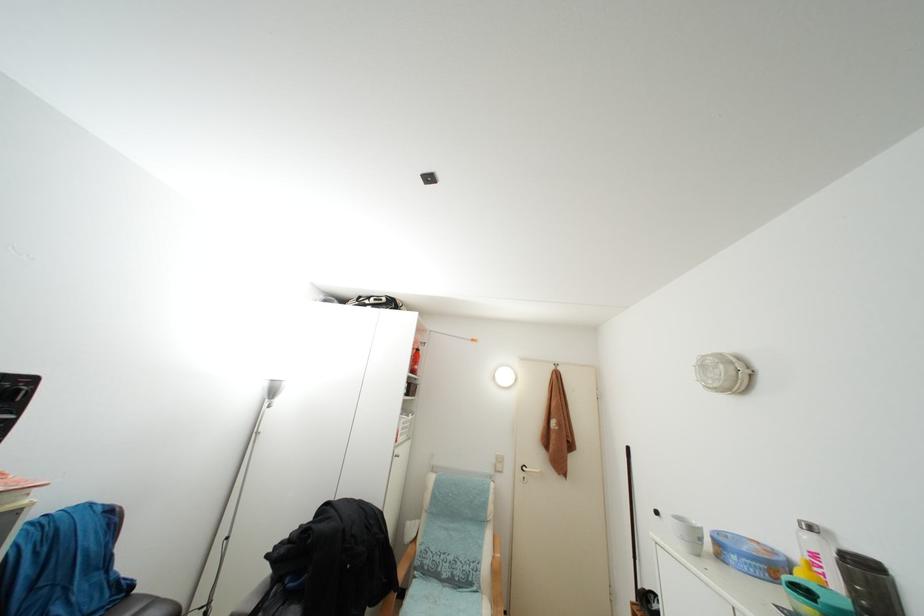
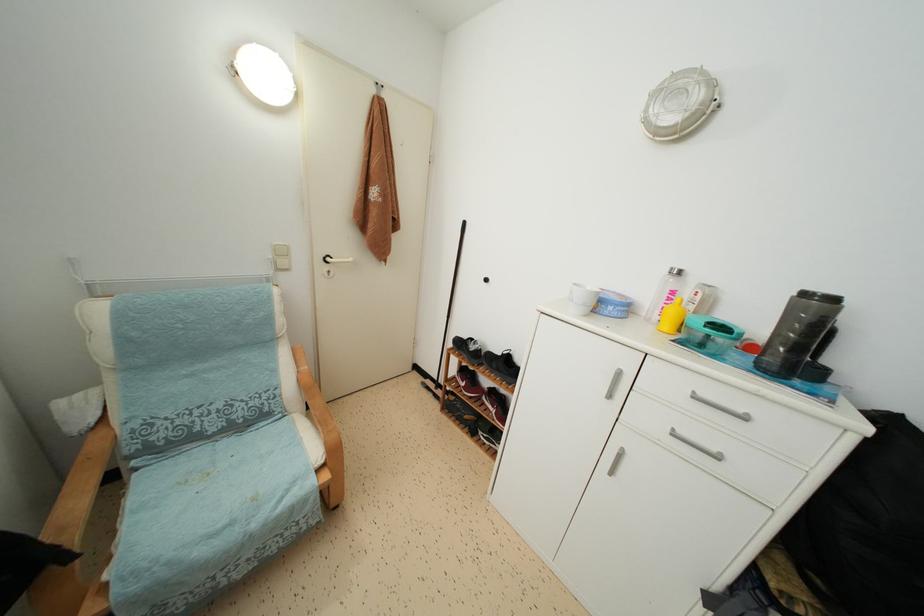
Where in the second image is the point corresponding to the point at 819,562 from the first image?

(676, 299)